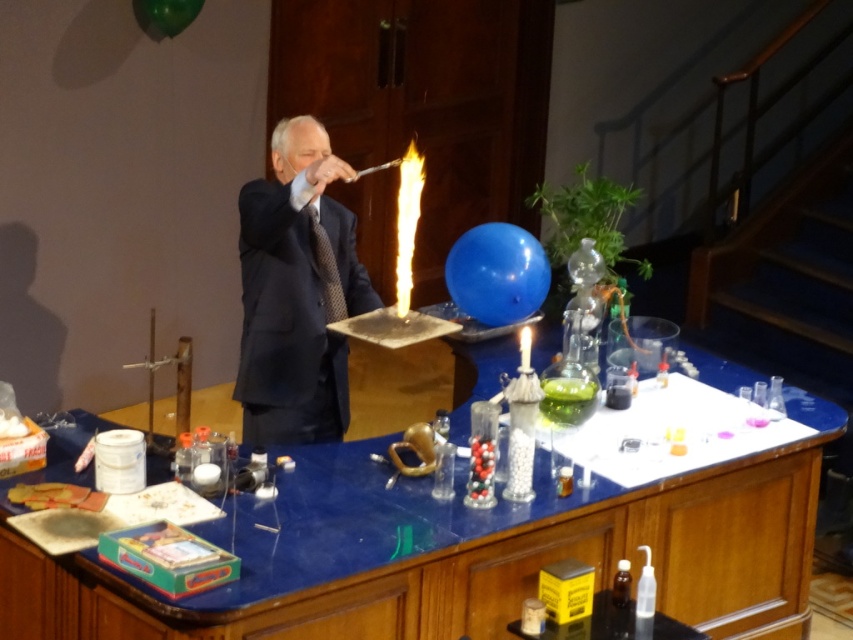
Question: Does matte blue balloon at center have a smaller size compared to green rubber balloon at upper center?

Choices:
 (A) yes
 (B) no

Answer: (B)

Question: Which of the following is the closest to the observer?

Choices:
 (A) black textured tie at center
 (B) matte blue balloon at center
 (C) white wax candle at center

Answer: (C)

Question: Which point is farther from the camera taking this photo?

Choices:
 (A) (177, 13)
 (B) (450, 529)
 (C) (332, 314)

Answer: (A)

Question: Is dark blue suit at center wider than green rubber balloon at upper center?

Choices:
 (A) yes
 (B) no

Answer: (A)

Question: Does blue glossy table at center have a smaller size compared to dark blue suit at center?

Choices:
 (A) no
 (B) yes

Answer: (A)

Question: Which point is farther to the camera?

Choices:
 (A) white wax candle at center
 (B) black textured tie at center
 (C) matte blue balloon at center
 (D) blue glossy table at center

Answer: (C)